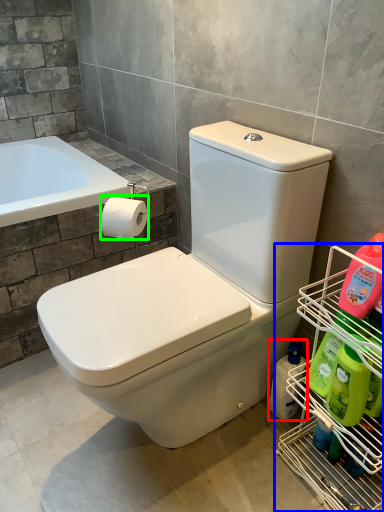
Question: Which object is positioned farthest from cleaning product (highlighted by a red box)? Select from shelf (highlighted by a blue box) and toilet paper (highlighted by a green box).

Choices:
 (A) shelf
 (B) toilet paper

Answer: (B)